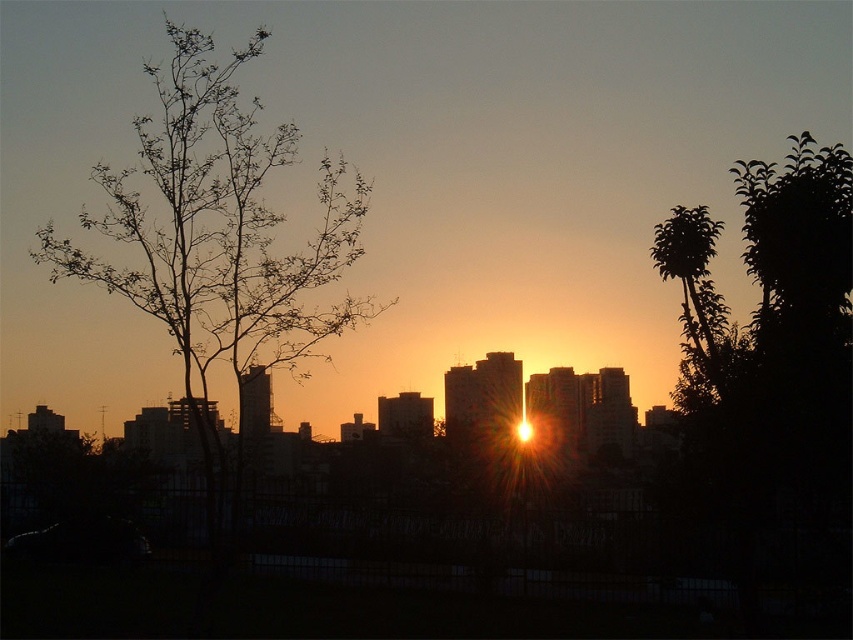
Does bare branches at left appear on the right side of green leafy tree at right?

Incorrect, bare branches at left is not on the right side of green leafy tree at right.

Who is shorter, bare branches at left or green leafy tree at right?

green leafy tree at right is shorter.

What do you see at coordinates (218, 230) in the screenshot? The height and width of the screenshot is (640, 853). I see `bare branches at left` at bounding box center [218, 230].

What are the coordinates of `bare branches at left` in the screenshot? It's located at (218, 230).